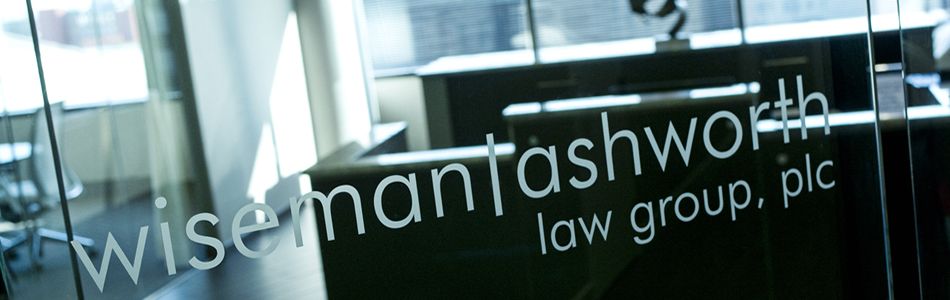
I want to click on trophy, so click(x=679, y=3).